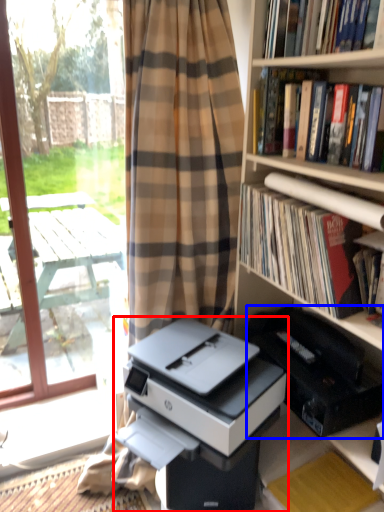
Question: Which object is closer to the camera taking this photo, printer (highlighted by a red box) or printer (highlighted by a blue box)?

Choices:
 (A) printer
 (B) printer

Answer: (A)